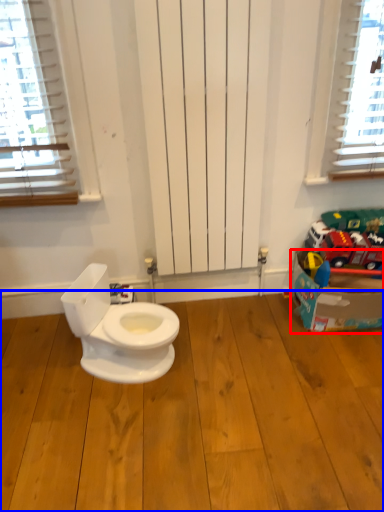
Question: Among these objects, which one is nearest to the camera, cardboard box (highlighted by a red box) or hardwood (highlighted by a blue box)?

Choices:
 (A) cardboard box
 (B) hardwood

Answer: (B)